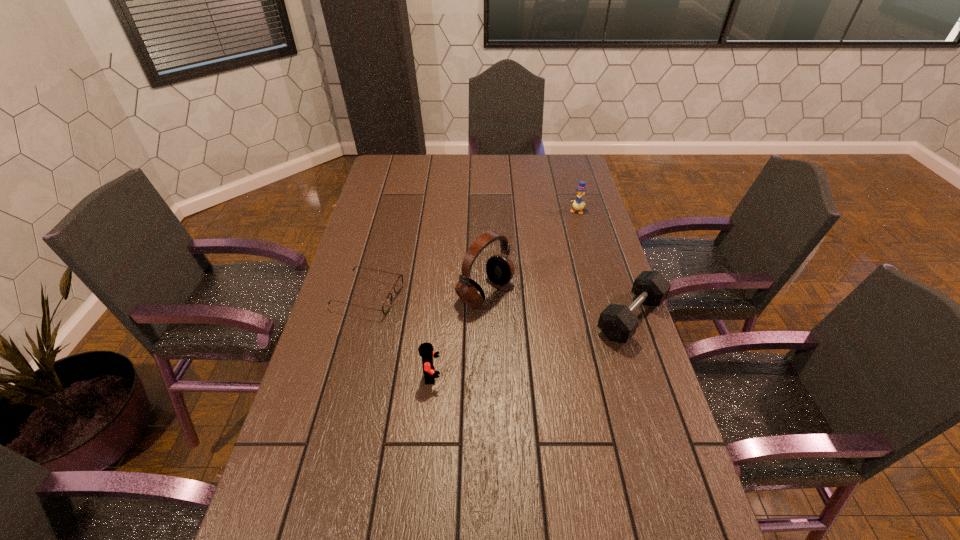
Find the location of `free spot on the desktop that is between the nearest object and the fourth tallest object and is positioned on the front-facing side of the leftmost object`. free spot on the desktop that is between the nearest object and the fourth tallest object and is positioned on the front-facing side of the leftmost object is located at coordinates (565, 336).

Locate an element on the screen. This screenshot has width=960, height=540. free spot on the desktop that is between the Lego and the dumbbell and is positioned on the face of the farthest object, where the monocle is placed is located at coordinates (509, 353).

Find the location of a particular element. free space on the desktop that is between the Lego and the second shortest object and is positioned on the ear pads of the tallest object is located at coordinates (560, 339).